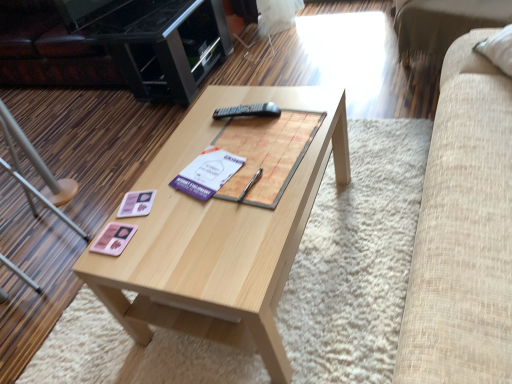
Question: Is black plastic remote at center in contact with pink matte coaster at center-left?

Choices:
 (A) no
 (B) yes

Answer: (A)

Question: Is black plastic remote at center closer to the viewer compared to pink matte coaster at center-left?

Choices:
 (A) yes
 (B) no

Answer: (B)

Question: Does black plastic remote at center have a lesser width compared to pink matte coaster at center-left?

Choices:
 (A) no
 (B) yes

Answer: (A)

Question: Does black plastic remote at center appear on the left side of pink matte coaster at center-left?

Choices:
 (A) yes
 (B) no

Answer: (B)

Question: Is black plastic remote at center to the right of pink matte coaster at center-left from the viewer's perspective?

Choices:
 (A) yes
 (B) no

Answer: (A)

Question: From a real-world perspective, is black glossy entertainment center at upper left positioned above or below metallic silver chair at lower left?

Choices:
 (A) below
 (B) above

Answer: (A)

Question: Is black glossy entertainment center at upper left to the left or to the right of metallic silver chair at lower left in the image?

Choices:
 (A) left
 (B) right

Answer: (B)

Question: Is black glossy entertainment center at upper left bigger or smaller than metallic silver chair at lower left?

Choices:
 (A) big
 (B) small

Answer: (A)

Question: Is point click(x=161, y=59) positioned closer to the camera than point click(x=12, y=147)?

Choices:
 (A) closer
 (B) farther

Answer: (A)

Question: In the image, is wooden magazine at center positioned in front of or behind beige fabric couch at upper right?

Choices:
 (A) front
 (B) behind

Answer: (A)

Question: Is wooden magazine at center wider or thinner than beige fabric couch at upper right?

Choices:
 (A) thin
 (B) wide

Answer: (A)

Question: Looking at the image, does wooden magazine at center seem bigger or smaller compared to beige fabric couch at upper right?

Choices:
 (A) big
 (B) small

Answer: (B)

Question: Considering the relative positions of wooden magazine at center and beige fabric couch at upper right in the image provided, is wooden magazine at center to the left or to the right of beige fabric couch at upper right?

Choices:
 (A) right
 (B) left

Answer: (B)

Question: In the image, is light wood coffee table at center on the left side or the right side of beige fabric couch at upper right?

Choices:
 (A) right
 (B) left

Answer: (B)

Question: Which is correct: light wood coffee table at center is inside beige fabric couch at upper right, or outside of it?

Choices:
 (A) inside
 (B) outside

Answer: (B)